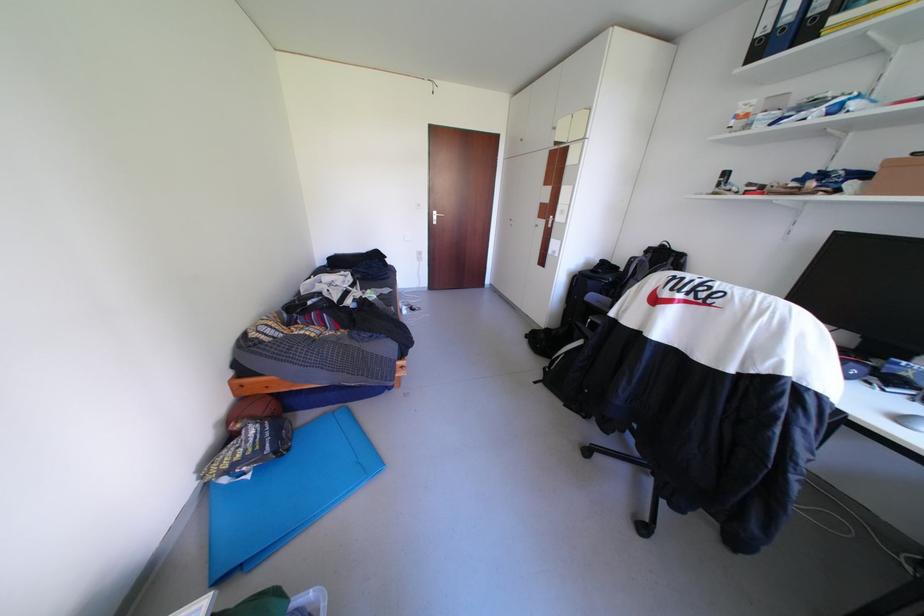
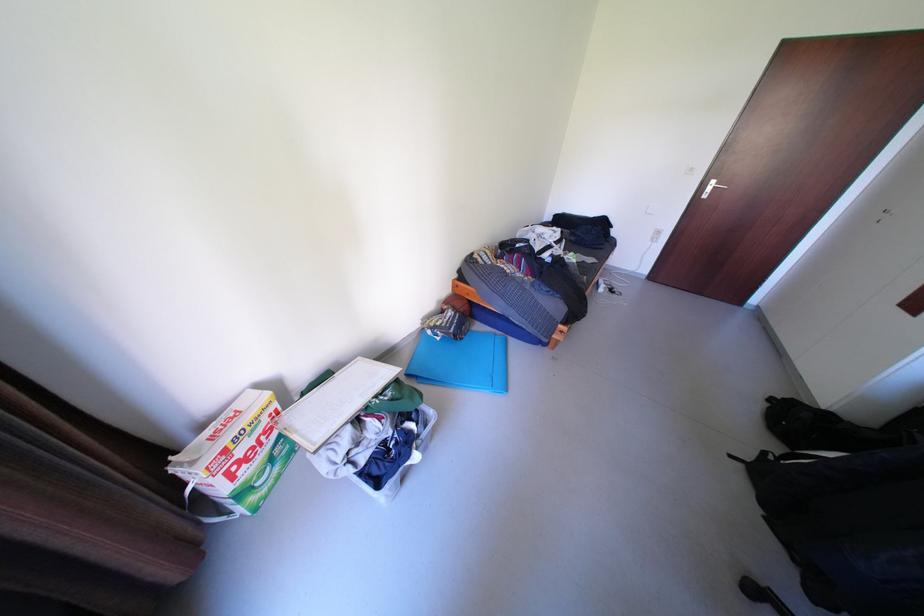
The point at (x=214, y=440) is marked in the first image. Where is the corresponding point in the second image?

(441, 305)